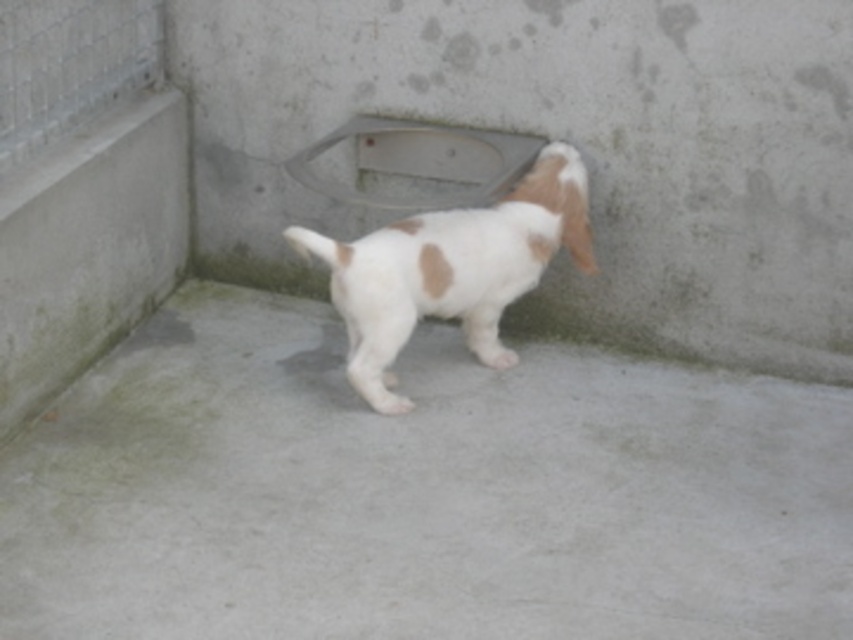
Is gray concrete pavement at center taller than white fur dog at center?

Incorrect, gray concrete pavement at center's height is not larger of white fur dog at center's.

Does gray concrete pavement at center have a lesser width compared to white fur dog at center?

No.

Who is more distant from viewer, (260, 417) or (492, 321)?

Positioned behind is point (492, 321).

The width and height of the screenshot is (853, 640). Identify the location of gray concrete pavement at center. (418, 492).

Does gray concrete at center have a greater height compared to white fur dog at center?

Correct, gray concrete at center is much taller as white fur dog at center.

Which of these two, gray concrete at center or white fur dog at center, stands shorter?

With less height is white fur dog at center.

This screenshot has width=853, height=640. What do you see at coordinates (567, 140) in the screenshot?
I see `gray concrete at center` at bounding box center [567, 140].

Locate an element on the screen. The height and width of the screenshot is (640, 853). gray concrete at center is located at coordinates [567, 140].

Is gray concrete pavement at center smaller than gray concrete at center?

No, gray concrete pavement at center is not smaller than gray concrete at center.

Can you confirm if gray concrete pavement at center is wider than gray concrete at center?

Yes, gray concrete pavement at center is wider than gray concrete at center.

Locate an element on the screen. Image resolution: width=853 pixels, height=640 pixels. gray concrete pavement at center is located at coordinates (418, 492).

Locate an element on the screen. This screenshot has height=640, width=853. gray concrete pavement at center is located at coordinates (418, 492).